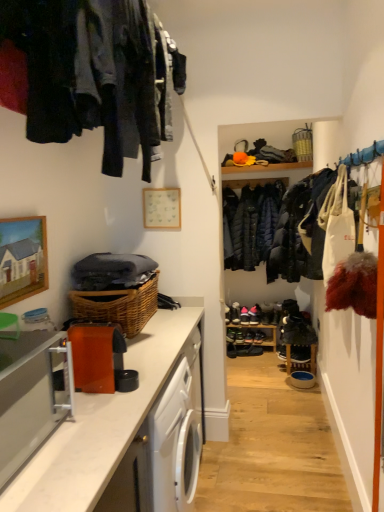
Question: In the image, is satin silver toaster at left on the left side or the right side of white matte picture frame at upper center, the 1th picture frame when ordered from back to front?

Choices:
 (A) right
 (B) left

Answer: (B)

Question: Considering the positions of point (8, 444) and point (147, 197), is point (8, 444) closer or farther from the camera than point (147, 197)?

Choices:
 (A) farther
 (B) closer

Answer: (B)

Question: Which of these objects is positioned closest to the black leather shoe at center, arranged as the sixth shoe when ordered from the bottom?

Choices:
 (A) satin silver toaster at left
 (B) wooden woven basket at upper right, the first basket from the right
 (C) shiny black shoe at center, marked as the 3th shoe in a top-to-bottom arrangement
 (D) shiny black shoe at center, which is counted as the 2th shoe, starting from the bottom
 (E) woven brown basket at lower left, positioned as the 1th basket in bottom-to-top order

Answer: (C)

Question: Which object is positioned farthest from the wooden shoe rack at center?

Choices:
 (A) dark blue quilted jacket at center, the 2th clothing in the left-to-right sequence
 (B) shiny black shoe at center, positioned as the third shoe in bottom-to-top order
 (C) white matte picture frame at upper center, which is counted as the second picture frame, starting from the front
 (D) shiny black shoe at center, the 2th shoe in the top-to-bottom sequence
 (E) dark gray fabric at upper left, the first clothing viewed from the left

Answer: (E)